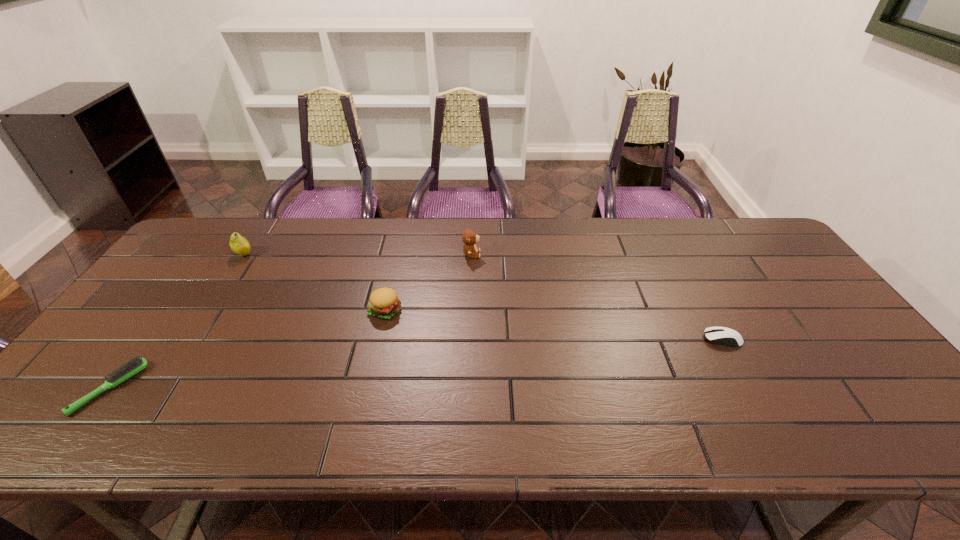
In the image, there is a desktop. Identify the location of vacant space at the left edge. Image resolution: width=960 pixels, height=540 pixels. (181, 294).

Where is `free space at the right edge of the desktop`? The image size is (960, 540). free space at the right edge of the desktop is located at coordinates (773, 268).

Where is `vacant area at the far right corner of the desktop`? The height and width of the screenshot is (540, 960). vacant area at the far right corner of the desktop is located at coordinates (723, 241).

You are a GUI agent. You are given a task and a screenshot of the screen. Output one action in this format:
    pyautogui.click(x=<x>, y=<y>)
    Task: Click on the vacant point at the near right corner
    
    Given the screenshot: What is the action you would take?
    pyautogui.click(x=878, y=443)

Find the location of a particular element. This screenshot has height=540, width=960. vacant region between the nearest object and the third tallest object is located at coordinates (248, 349).

The width and height of the screenshot is (960, 540). In order to click on empty location between the second object from right to left and the leftmost object in this screenshot , I will do `click(291, 321)`.

Locate an element on the screen. vacant region between the third object from left to right and the rightmost object is located at coordinates (554, 325).

Where is `vacant area that lies between the second object from right to left and the rightmost object`? The image size is (960, 540). vacant area that lies between the second object from right to left and the rightmost object is located at coordinates (597, 297).

Where is `vacant space in between the fourth object from right to left and the fourth farthest object`? Image resolution: width=960 pixels, height=540 pixels. vacant space in between the fourth object from right to left and the fourth farthest object is located at coordinates (483, 296).

Where is `vacant area that lies between the third tallest object and the fourth object from left to right`? This screenshot has height=540, width=960. vacant area that lies between the third tallest object and the fourth object from left to right is located at coordinates (428, 282).